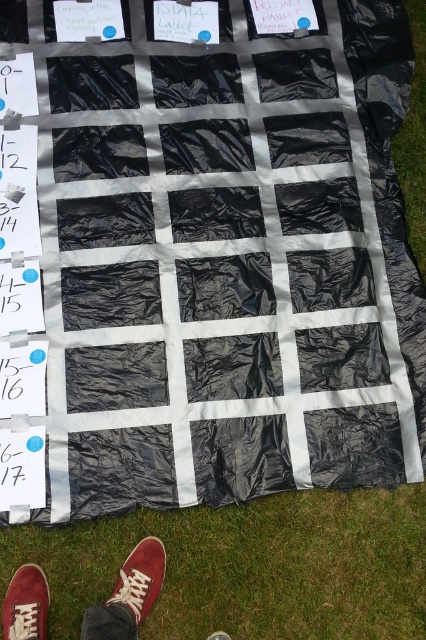
Based on the photo, can you confirm if brown suede shoe at lower left is positioned below white canvas shoe at lower center?

No.

Is brown suede shoe at lower left smaller than white canvas shoe at lower center?

Incorrect, brown suede shoe at lower left is not smaller in size than white canvas shoe at lower center.

Is point (8, 604) closer to camera compared to point (229, 637)?

Yes, point (8, 604) is closer to viewer.

Where is `brown suede shoe at lower left`? brown suede shoe at lower left is located at coordinates (x=25, y=604).

In the scene shown: Does brown suede shoe at lower left have a smaller size compared to suede/leather shoe at lower center?

Correct, brown suede shoe at lower left occupies less space than suede/leather shoe at lower center.

Can you confirm if brown suede shoe at lower left is positioned below suede/leather shoe at lower center?

Yes, brown suede shoe at lower left is below suede/leather shoe at lower center.

Does point (23, 604) come in front of point (135, 561)?

Yes.

Where is `brown suede shoe at lower left`? brown suede shoe at lower left is located at coordinates (25, 604).

Who is positioned more to the right, suede/leather shoe at lower center or white canvas shoe at lower center?

white canvas shoe at lower center is more to the right.

Where is `suede/leather shoe at lower center`? The width and height of the screenshot is (426, 640). suede/leather shoe at lower center is located at coordinates (141, 577).

Identify the location of suede/leather shoe at lower center. Image resolution: width=426 pixels, height=640 pixels. (141, 577).

The width and height of the screenshot is (426, 640). What are the coordinates of `suede/leather shoe at lower center` in the screenshot? It's located at (141, 577).